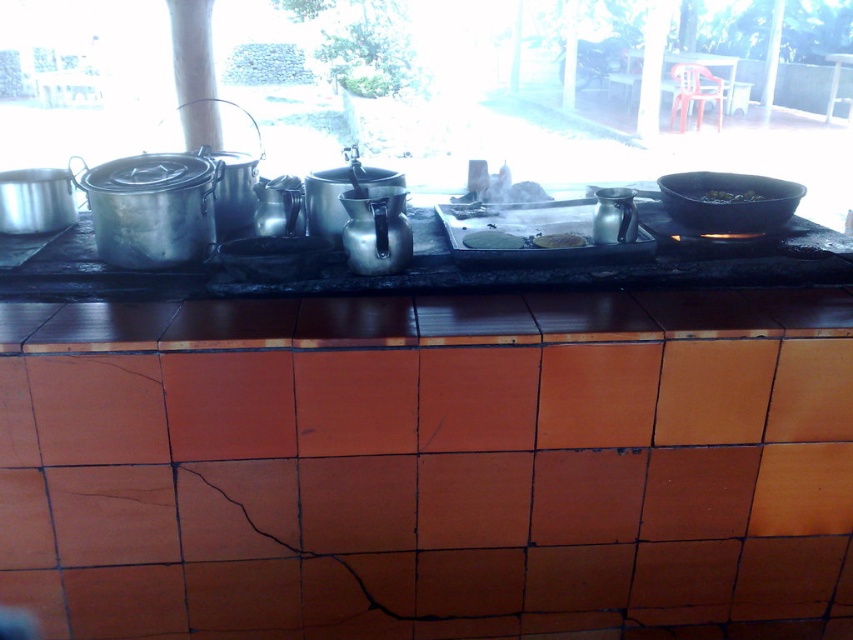
Is metallic/reflective counter at center to the right of black matte pan at upper right from the viewer's perspective?

No, metallic/reflective counter at center is not to the right of black matte pan at upper right.

Does metallic/reflective counter at center lie in front of black matte pan at upper right?

Yes, it is in front of black matte pan at upper right.

Between point (144, 572) and point (750, 193), which one is positioned in front?

Point (144, 572) is more forward.

This screenshot has height=640, width=853. Find the location of `metallic/reflective counter at center`. metallic/reflective counter at center is located at coordinates (425, 464).

Does point (787, 189) come behind point (708, 200)?

No, (787, 189) is closer to viewer.

How much distance is there between black matte frying pan at right and black matte pan at upper right?

black matte frying pan at right and black matte pan at upper right are 1.82 inches apart.

This screenshot has width=853, height=640. In order to click on black matte frying pan at right in this screenshot , I will do click(x=728, y=200).

Describe the element at coordinates (730, 195) in the screenshot. This screenshot has width=853, height=640. I see `black matte pan at upper right` at that location.

Is point (761, 195) closer to camera compared to point (564, 234)?

No, it is behind (564, 234).

Find the location of a particular element. The height and width of the screenshot is (640, 853). black matte pan at upper right is located at coordinates (730, 195).